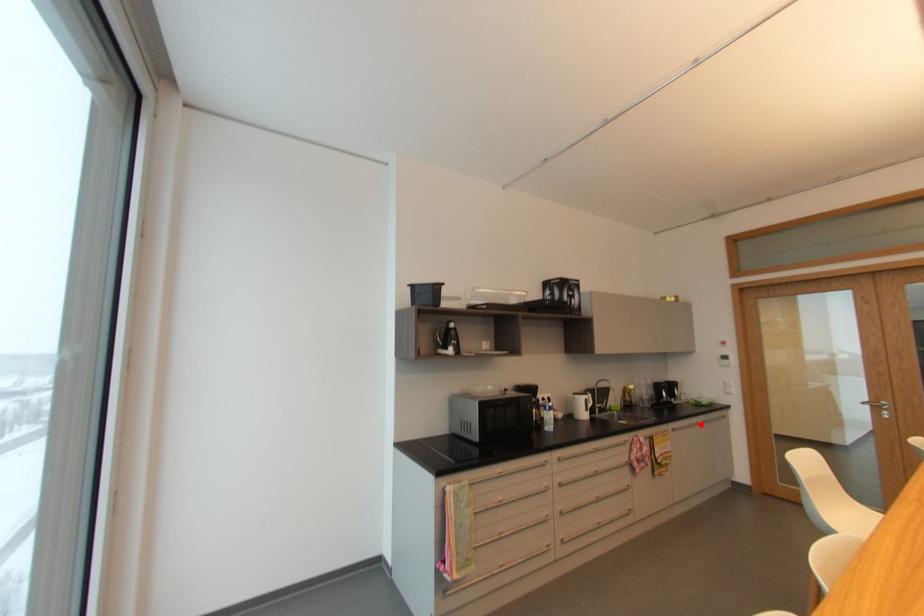
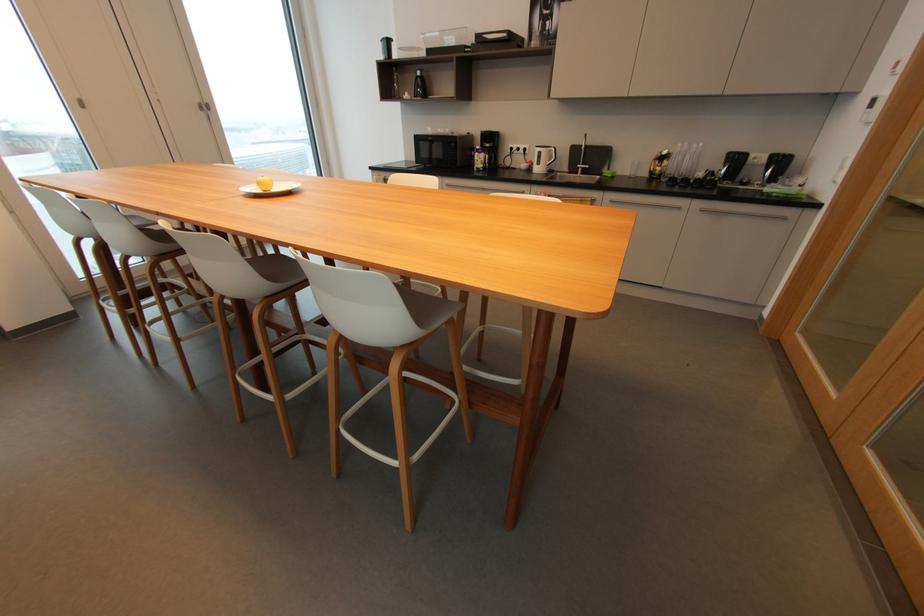
Locate, in the second image, the point that corresponds to the highlighted location in the first image.

(683, 208)